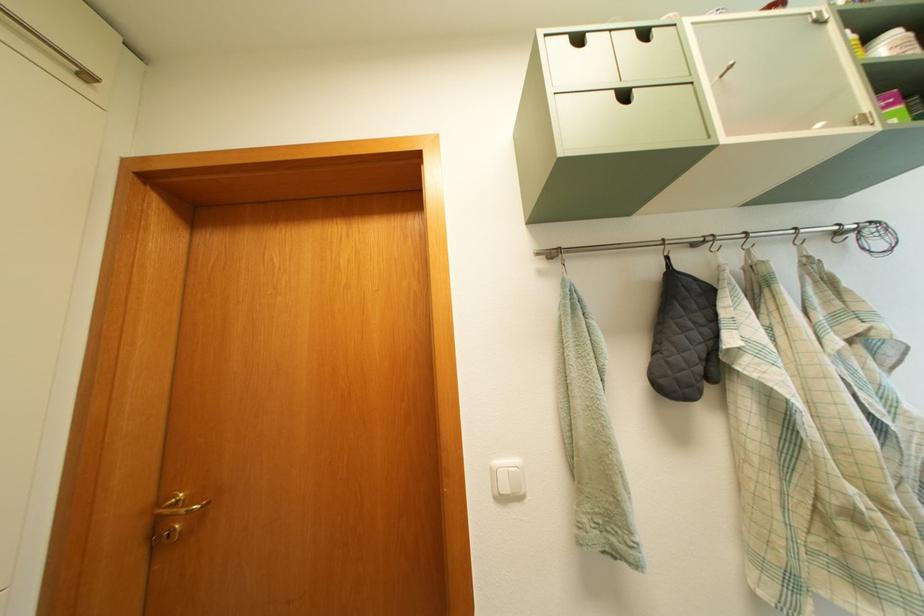
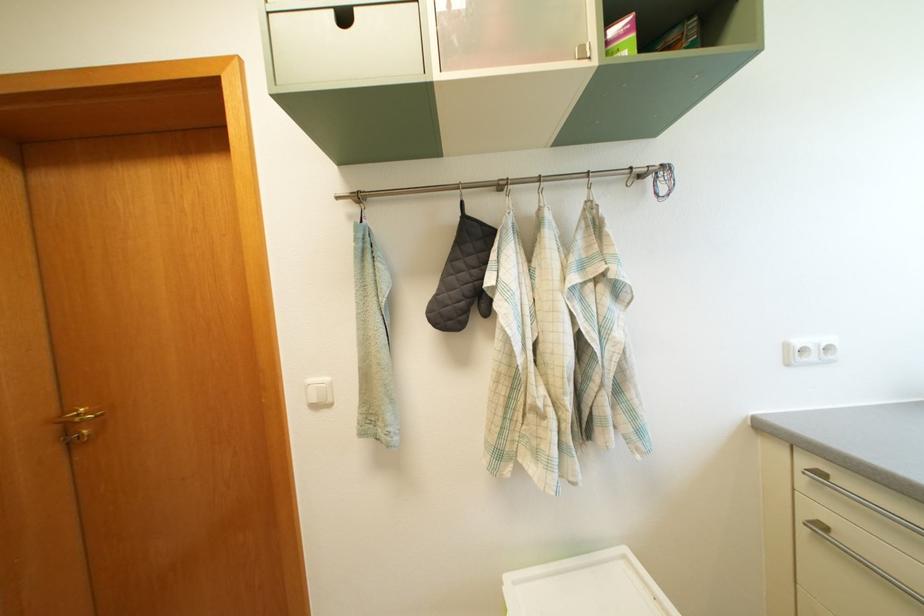
Locate, in the second image, the point that corresponds to point 878,238 in the first image.

(669, 180)